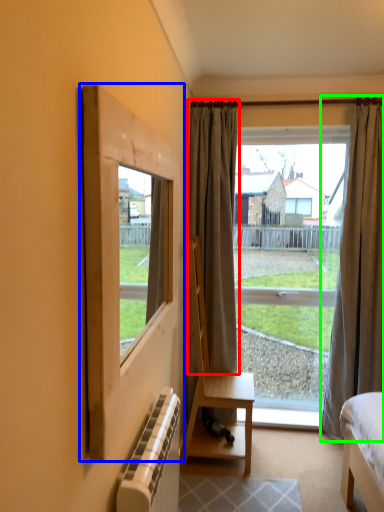
Question: Which object is positioned closest to curtain (highlighted by a red box)? Select from window frame (highlighted by a blue box) and curtain (highlighted by a green box).

Choices:
 (A) window frame
 (B) curtain

Answer: (B)